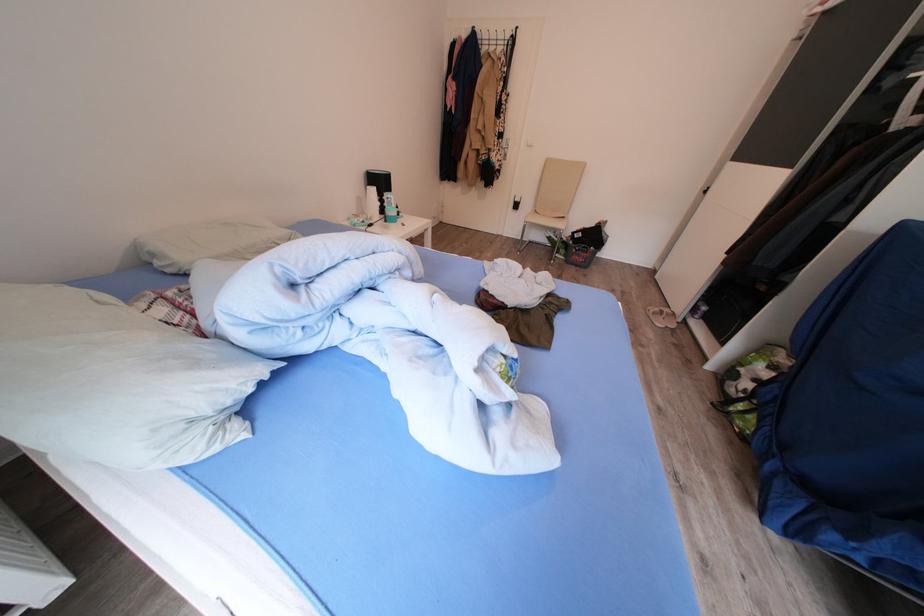
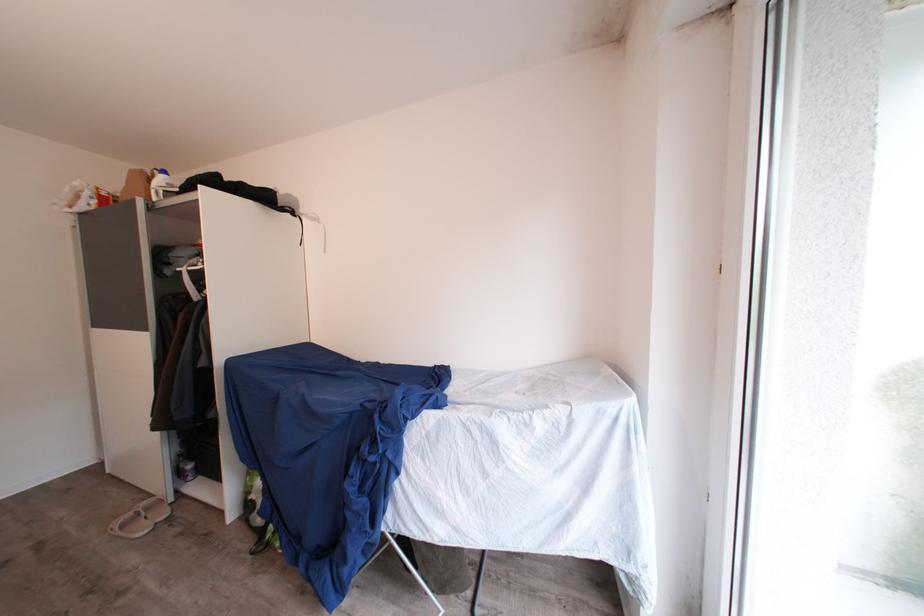
Question: The camera is either moving clockwise (left) or counter-clockwise (right) around the object. The first image is from the beginning of the video and the second image is from the end. Is the camera moving left or right when shooting the video?

Choices:
 (A) Left
 (B) Right

Answer: (A)